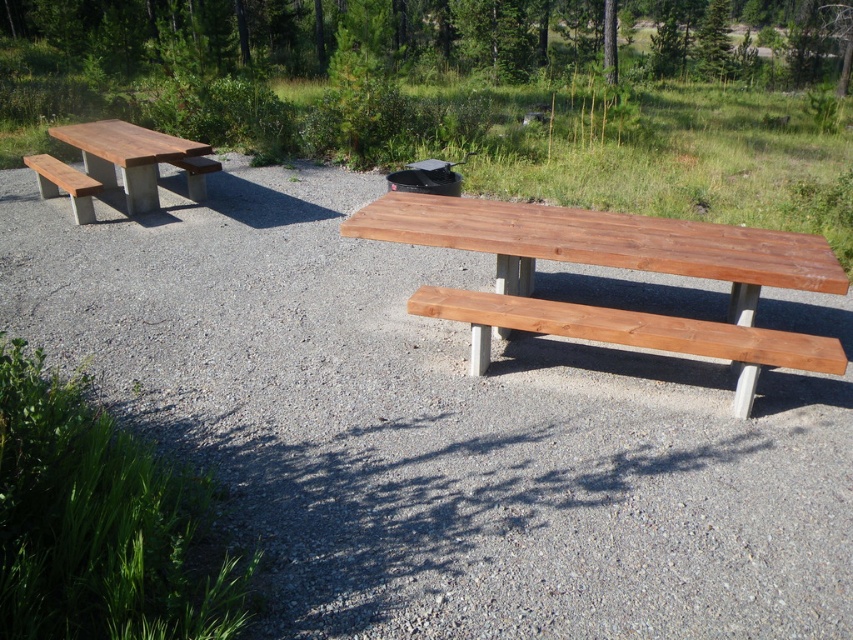
Question: Which of these objects is positioned farthest from the matte wood picnic table at left?

Choices:
 (A) wooden bench at left
 (B) matte wood bench at left
 (C) green leafy tree at upper center

Answer: (C)

Question: Is shiny brown wood picnic table at center closer to the viewer compared to matte wood bench at left?

Choices:
 (A) yes
 (B) no

Answer: (A)

Question: Among these points, which one is farthest from the camera?

Choices:
 (A) (39, 186)
 (B) (180, 147)
 (C) (218, 161)

Answer: (C)

Question: Does matte wood picnic table at left have a lesser width compared to wooden bench at left?

Choices:
 (A) no
 (B) yes

Answer: (A)

Question: Among these points, which one is nearest to the camera?

Choices:
 (A) click(183, 168)
 (B) click(83, 196)
 (C) click(357, 24)
 (D) click(192, 150)

Answer: (B)

Question: Can you confirm if shiny brown wood picnic table at center is smaller than matte wood bench at left?

Choices:
 (A) yes
 (B) no

Answer: (B)